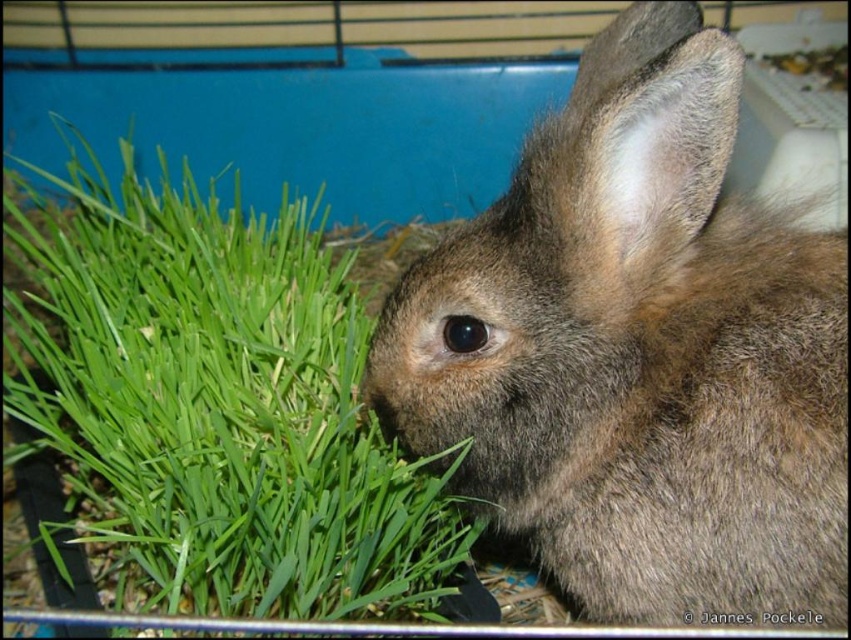
Question: Which point is farther to the camera?

Choices:
 (A) green leafy grass at left
 (B) brown furry rabbit at center

Answer: (A)

Question: Which point is closer to the camera taking this photo?

Choices:
 (A) (615, 227)
 (B) (326, 328)

Answer: (A)

Question: Does brown furry rabbit at center appear over green leafy grass at left?

Choices:
 (A) no
 (B) yes

Answer: (A)

Question: Is brown furry rabbit at center thinner than green leafy grass at left?

Choices:
 (A) yes
 (B) no

Answer: (A)

Question: Is brown furry rabbit at center thinner than green leafy grass at left?

Choices:
 (A) yes
 (B) no

Answer: (A)

Question: Which object appears closest to the camera in this image?

Choices:
 (A) brown furry rabbit at center
 (B) green leafy grass at left

Answer: (A)